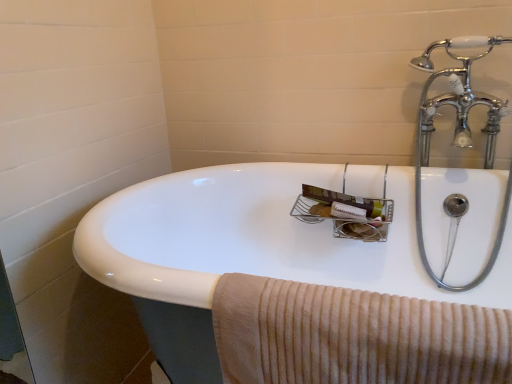
Image resolution: width=512 pixels, height=384 pixels. Find the location of `vacant region above beige corduroy towel at lower right (from a real-world perspective)`. vacant region above beige corduroy towel at lower right (from a real-world perspective) is located at coordinates (365, 303).